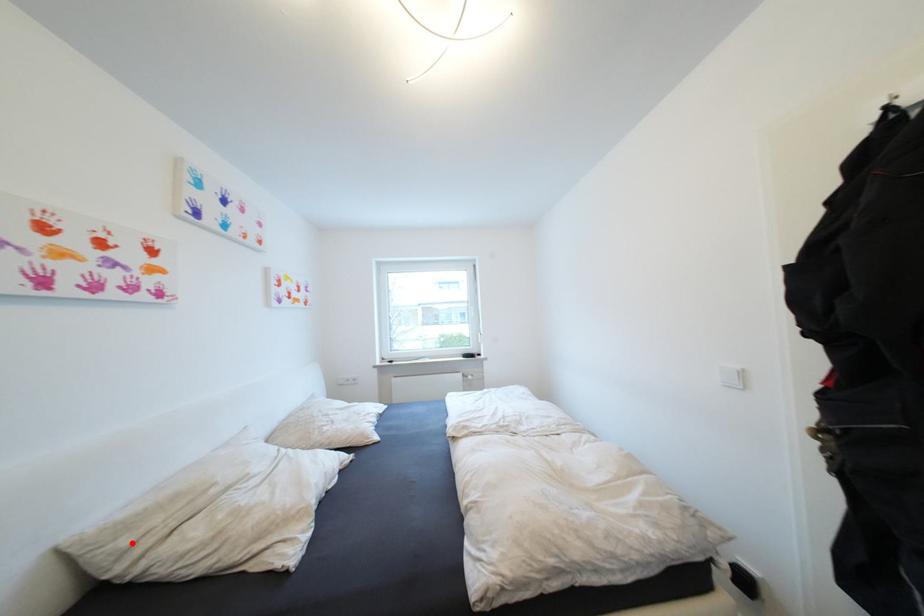
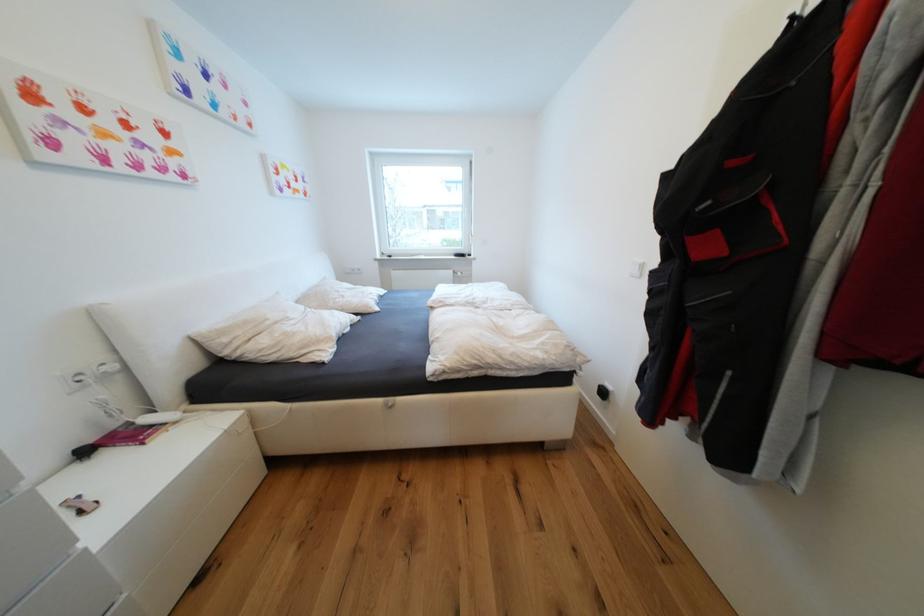
The point at the highlighted location is marked in the first image. Where is the corresponding point in the second image?

(233, 341)